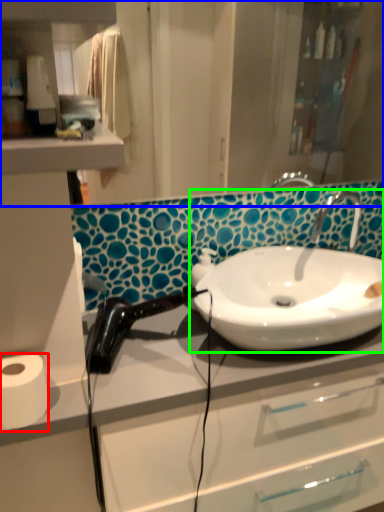
Question: Based on their relative distances, which object is farther from toilet paper (highlighted by a red box)? Choose from mirror (highlighted by a blue box) and sink (highlighted by a green box).

Choices:
 (A) mirror
 (B) sink

Answer: (A)